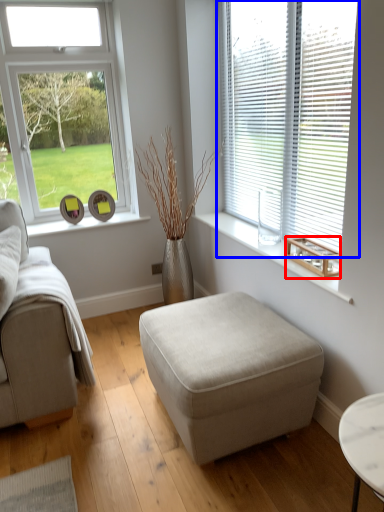
Question: Which of the following is the closest to the observer, wood (highlighted by a red box) or window (highlighted by a blue box)?

Choices:
 (A) wood
 (B) window

Answer: (B)